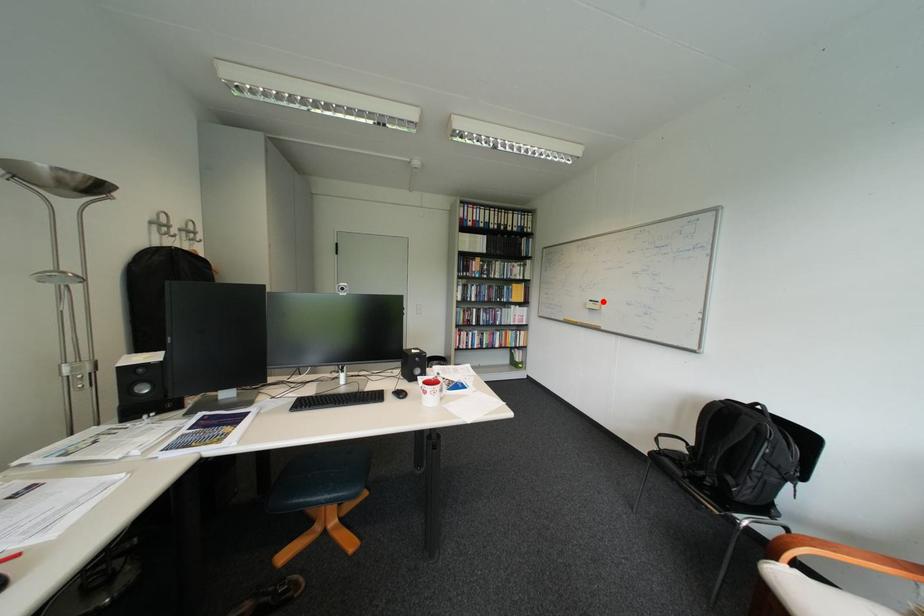
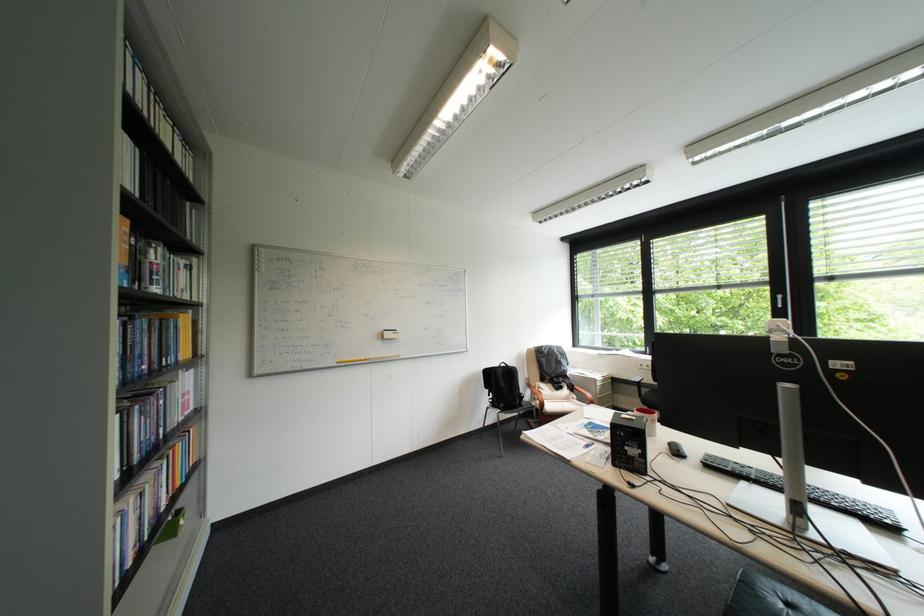
Where in the second image is the point corresponding to the highlighted location from the first image?

(397, 331)